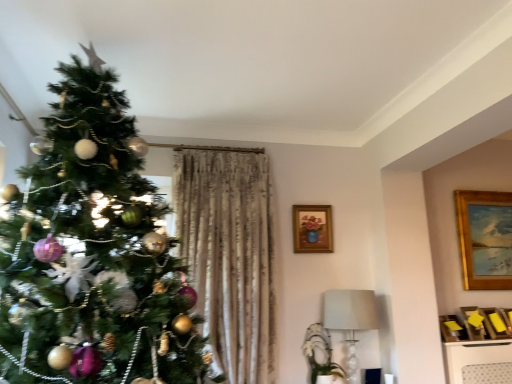
Question: Considering the relative sizes of shiny metallic ornaments at left and gold wooden picture frame at upper right, marked as the second picture frame in a left-to-right arrangement, in the image provided, is shiny metallic ornaments at left taller than gold wooden picture frame at upper right, marked as the second picture frame in a left-to-right arrangement,?

Choices:
 (A) no
 (B) yes

Answer: (B)

Question: From a real-world perspective, is shiny metallic ornaments at left physically above gold wooden picture frame at upper right, which is counted as the first picture frame, starting from the back?

Choices:
 (A) no
 (B) yes

Answer: (A)

Question: Is the depth of shiny metallic ornaments at left less than that of gold wooden picture frame at upper right, which is counted as the first picture frame, starting from the back?

Choices:
 (A) yes
 (B) no

Answer: (A)

Question: Is shiny metallic ornaments at left positioned beyond the bounds of gold wooden picture frame at upper right, marked as the first picture frame in a right-to-left arrangement?

Choices:
 (A) no
 (B) yes

Answer: (B)

Question: Is shiny metallic ornaments at left at the right side of gold wooden picture frame at upper right, marked as the second picture frame in a left-to-right arrangement?

Choices:
 (A) yes
 (B) no

Answer: (B)

Question: In the image, is gold wooden picture frame at upper right, marked as the first picture frame in a right-to-left arrangement, on the left side or the right side of wooden frame with floral painting at upper center, arranged as the 1th picture frame when viewed from the front?

Choices:
 (A) left
 (B) right

Answer: (B)

Question: In terms of height, does gold wooden picture frame at upper right, marked as the second picture frame in a left-to-right arrangement, look taller or shorter compared to wooden frame with floral painting at upper center, arranged as the 1th picture frame when viewed from the front?

Choices:
 (A) tall
 (B) short

Answer: (A)

Question: Considering the positions of gold wooden picture frame at upper right, which is counted as the first picture frame, starting from the back, and wooden frame with floral painting at upper center, placed as the 2th picture frame when sorted from right to left, in the image, is gold wooden picture frame at upper right, which is counted as the first picture frame, starting from the back, bigger or smaller than wooden frame with floral painting at upper center, placed as the 2th picture frame when sorted from right to left,?

Choices:
 (A) big
 (B) small

Answer: (A)

Question: Is gold wooden picture frame at upper right, marked as the second picture frame in a left-to-right arrangement, in front of or behind wooden frame with floral painting at upper center, placed as the 2th picture frame when sorted from right to left, in the image?

Choices:
 (A) front
 (B) behind

Answer: (B)

Question: From the image's perspective, is wooden frame with floral painting at upper center, the 1th picture frame in the left-to-right sequence, above or below shiny metallic ornaments at left?

Choices:
 (A) above
 (B) below

Answer: (B)

Question: Would you say wooden frame with floral painting at upper center, which is the second picture frame from back to front, is to the left or to the right of shiny metallic ornaments at left in the picture?

Choices:
 (A) right
 (B) left

Answer: (A)

Question: Which is correct: wooden frame with floral painting at upper center, which is the second picture frame from back to front, is inside shiny metallic ornaments at left, or outside of it?

Choices:
 (A) inside
 (B) outside

Answer: (B)

Question: Considering their positions, is wooden frame with floral painting at upper center, the 1th picture frame in the left-to-right sequence, located in front of or behind shiny metallic ornaments at left?

Choices:
 (A) front
 (B) behind

Answer: (B)

Question: Looking at their shapes, would you say white fabric lampshade at lower right is wider or thinner than shiny metallic ornaments at left?

Choices:
 (A) wide
 (B) thin

Answer: (B)

Question: In terms of height, does white fabric lampshade at lower right look taller or shorter compared to shiny metallic ornaments at left?

Choices:
 (A) short
 (B) tall

Answer: (A)